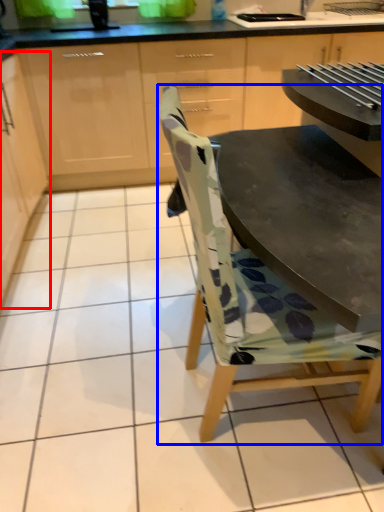
Question: Which object appears closest to the camera in this image, cabinetry (highlighted by a red box) or chair (highlighted by a blue box)?

Choices:
 (A) cabinetry
 (B) chair

Answer: (B)